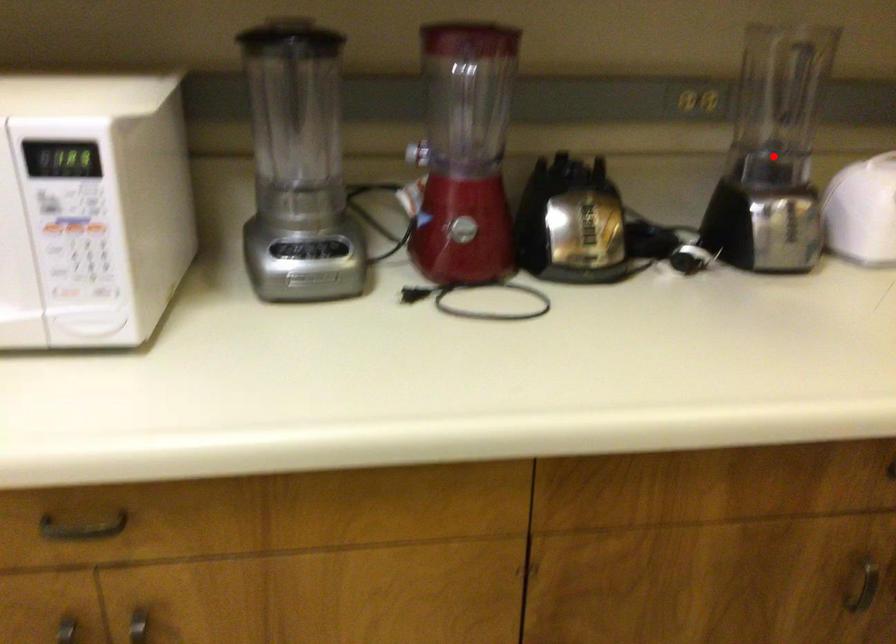
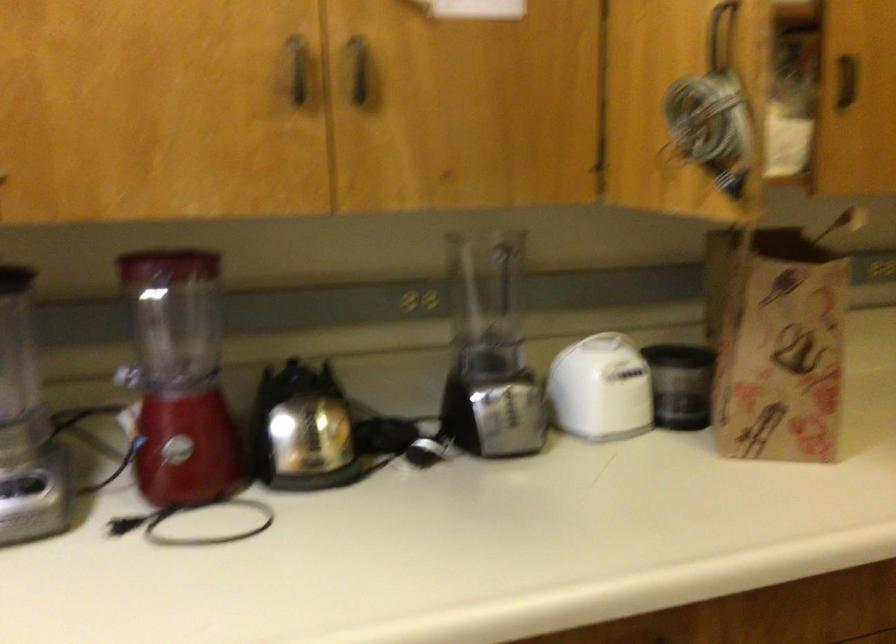
Locate, in the second image, the point that corresponds to the highlighted location in the first image.

(489, 351)